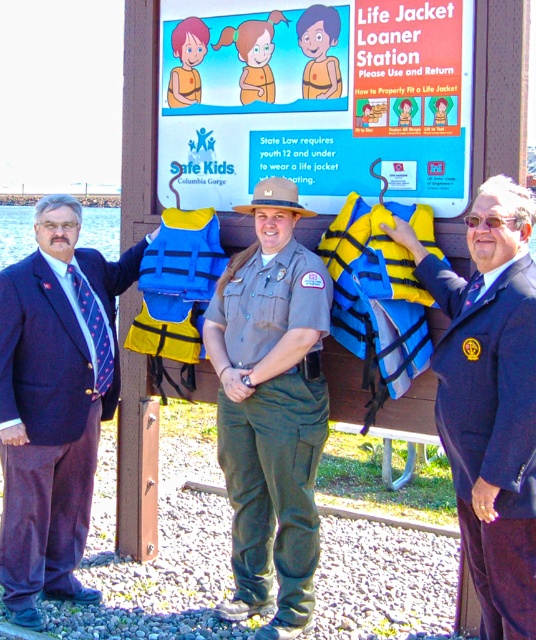
You are a visitor at the Life Jacket Loaner Station. You see a khaki uniform at center and an orange life jacket at center. Which item is positioned lower?

The khaki uniform at center is positioned below the orange life jacket at center, so the khaki uniform at center is lower.

Based on the coordinates provided in the objects description, which object is located at point (55, 403)?

The point (55, 403) marks the blue fabric suit at left.

What are the coordinates of the yellow fabric life jacket at center in the image?

The yellow fabric life jacket at center is located at coordinates point (379,294).